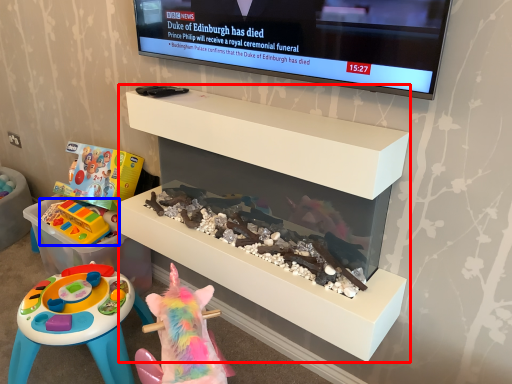
Question: Which object is further to the camera taking this photo, furniture (highlighted by a red box) or toy (highlighted by a blue box)?

Choices:
 (A) furniture
 (B) toy

Answer: (B)